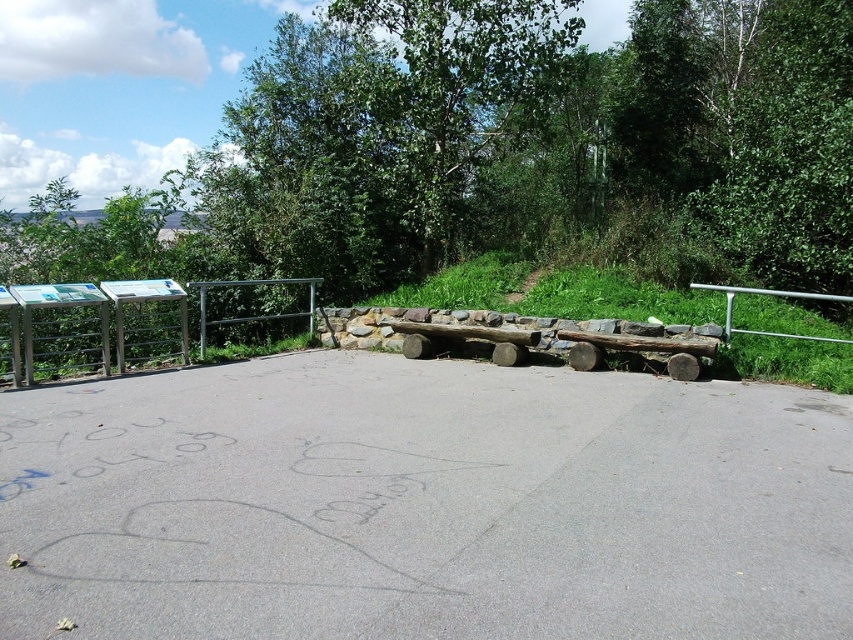
Does silver metallic fence at left have a greater height compared to silver metallic rail at right?

Correct, silver metallic fence at left is much taller as silver metallic rail at right.

Image resolution: width=853 pixels, height=640 pixels. What do you see at coordinates (94, 326) in the screenshot?
I see `silver metallic fence at left` at bounding box center [94, 326].

This screenshot has width=853, height=640. What are the coordinates of `silver metallic fence at left` in the screenshot? It's located at (94, 326).